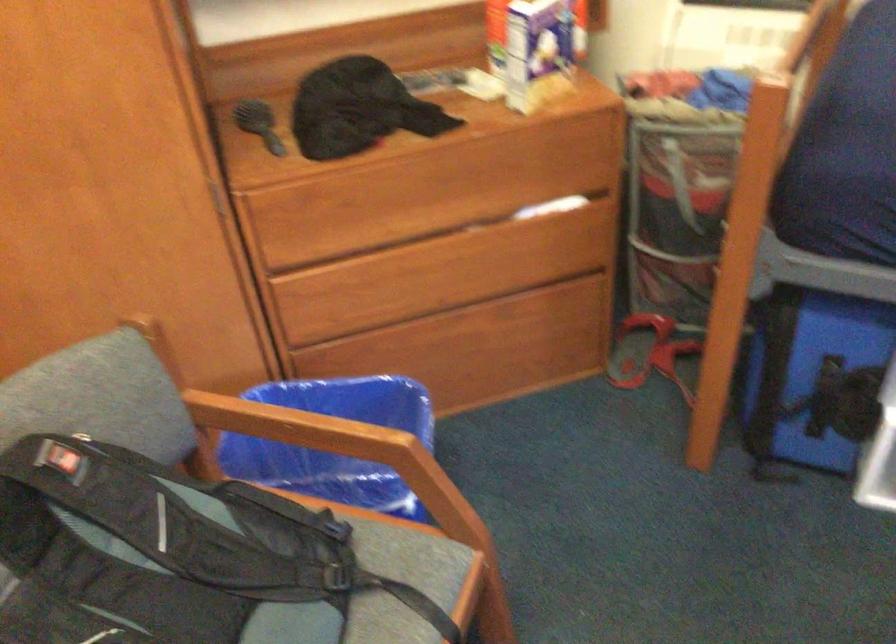
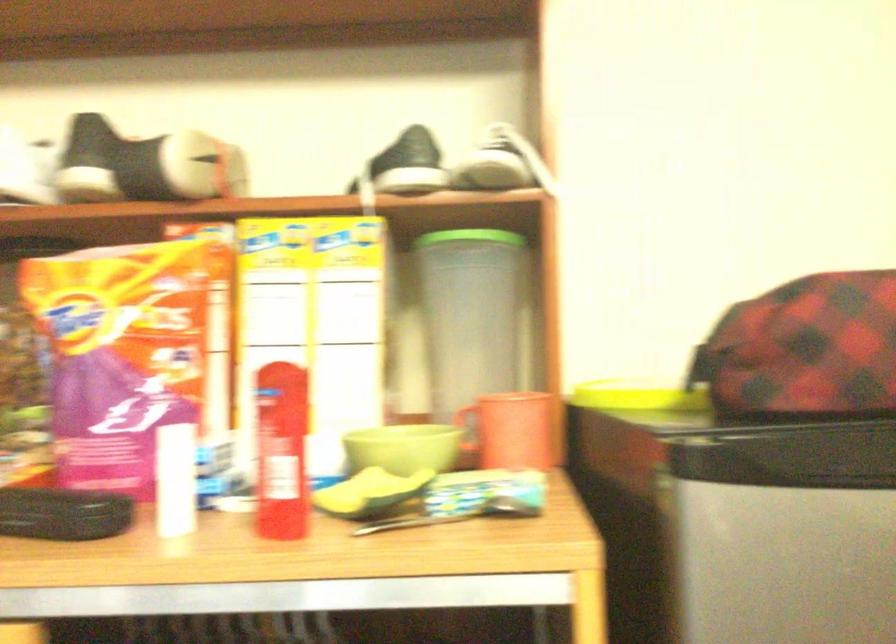
Question: The first image is from the beginning of the video and the second image is from the end. How did the camera likely rotate when shooting the video?

Choices:
 (A) Left
 (B) Right
 (C) Up
 (D) Down

Answer: (A)